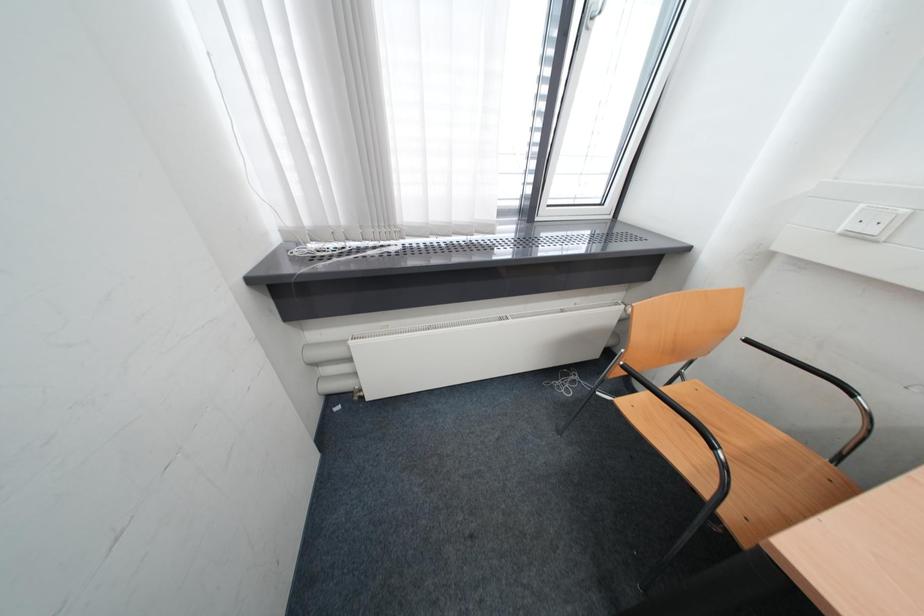
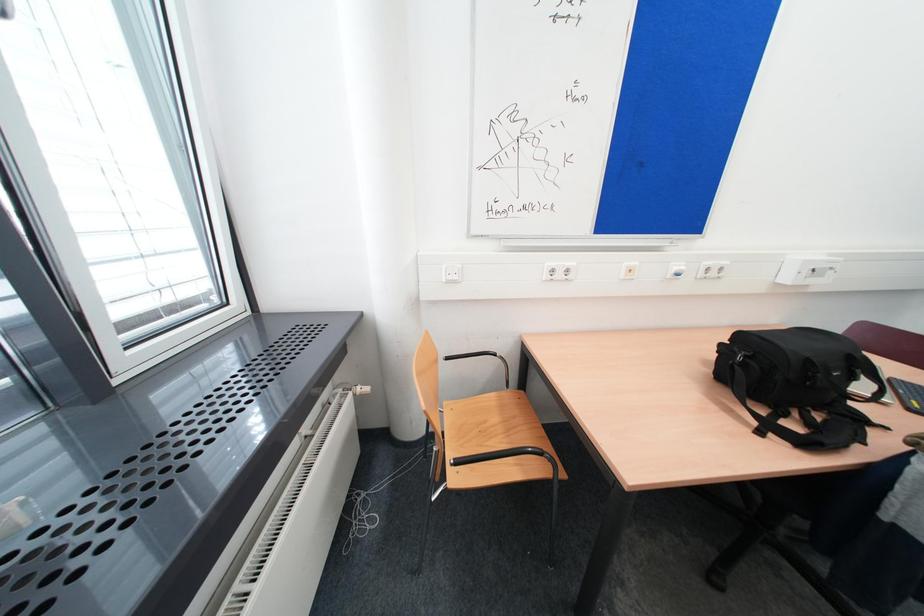
Question: The camera is either moving clockwise (left) or counter-clockwise (right) around the object. The first image is from the beginning of the video and the second image is from the end. Is the camera moving left or right when shooting the video?

Choices:
 (A) Left
 (B) Right

Answer: (A)